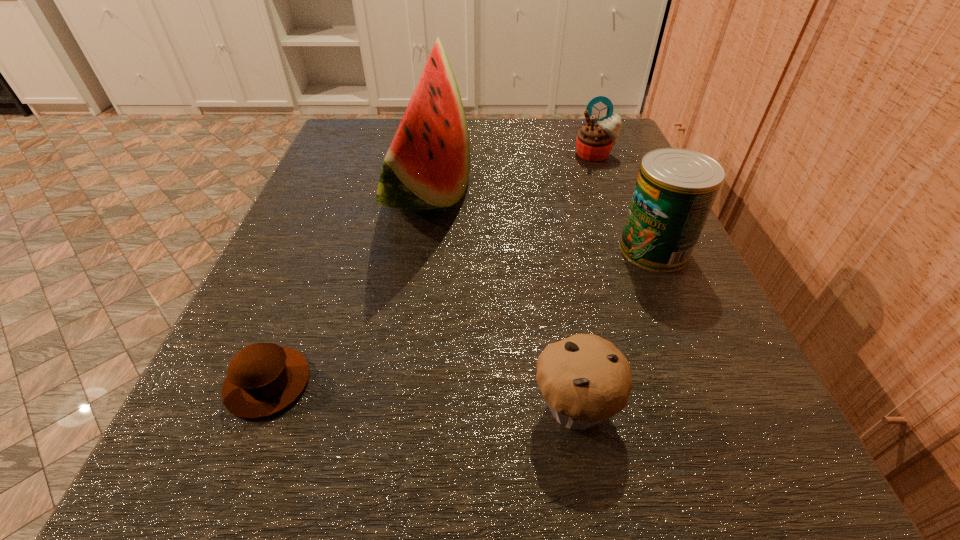
Where is `free space between the second shortest object and the fourth shortest object`? The image size is (960, 540). free space between the second shortest object and the fourth shortest object is located at coordinates (614, 328).

The width and height of the screenshot is (960, 540). In order to click on vacant space that's between the second shortest muffin and the third tallest object in this screenshot , I will do (x=585, y=281).

Where is `free area in between the can and the leftmost muffin`? The width and height of the screenshot is (960, 540). free area in between the can and the leftmost muffin is located at coordinates (461, 316).

The image size is (960, 540). In order to click on empty location between the shortest object and the can in this screenshot , I will do point(461,316).

At what (x,y) coordinates should I click in order to perform the action: click on blank region between the second tallest object and the third shortest object. Please return your answer as a coordinate pair (x, y). This screenshot has width=960, height=540. Looking at the image, I should click on 625,202.

At what (x,y) coordinates should I click in order to perform the action: click on unoccupied position between the can and the tallest object. Please return your answer as a coordinate pair (x, y). This screenshot has height=540, width=960. Looking at the image, I should click on click(541, 220).

The image size is (960, 540). I want to click on free space between the fourth tallest object and the fourth shortest object, so click(614, 328).

Locate an element on the screen. The image size is (960, 540). empty space between the fourth object from right to left and the second muffin from left to right is located at coordinates (502, 299).

Where is `vacant area that lies between the shortest muffin and the tallest muffin`? The height and width of the screenshot is (540, 960). vacant area that lies between the shortest muffin and the tallest muffin is located at coordinates (431, 269).

Where is `object that can be found as the fourth closest to the leftmost muffin`? The image size is (960, 540). object that can be found as the fourth closest to the leftmost muffin is located at coordinates (x=594, y=142).